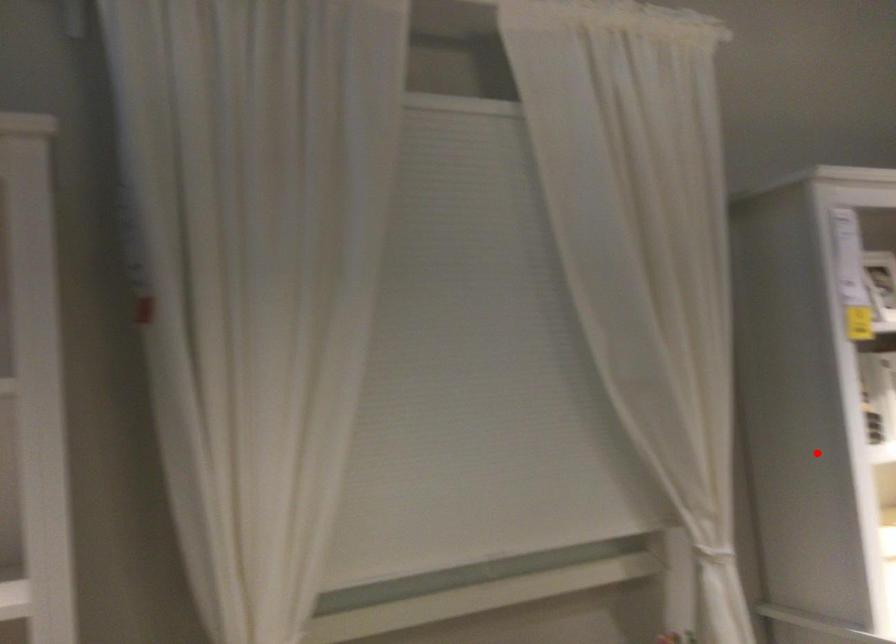
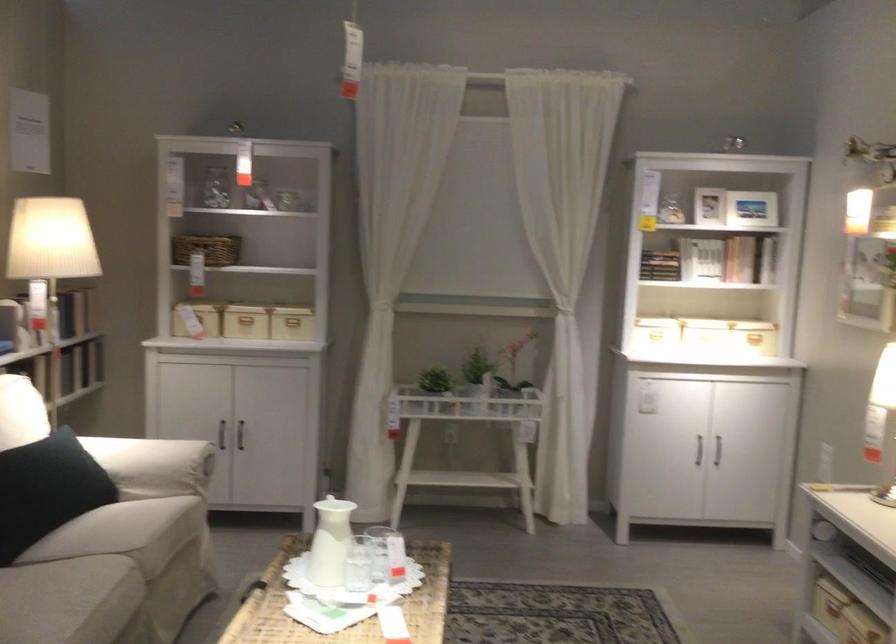
Question: I am providing you with two images of the same scene from different viewpoints. A red point is shown in image1. For the corresponding object point in image2, is it positioned nearer or farther from the camera?

Choices:
 (A) Nearer
 (B) Farther

Answer: (B)